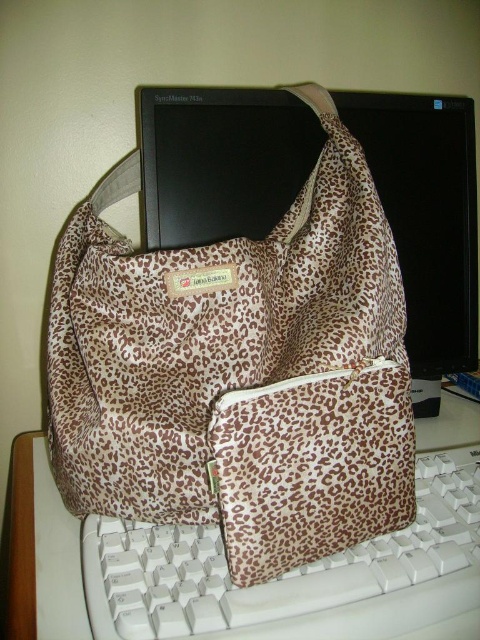
Question: Can you confirm if leopard print fabric bag at center is wider than white plastic keyboard at lower center?

Choices:
 (A) no
 (B) yes

Answer: (A)

Question: Is leopard print fabric bag at center wider than black glossy monitor at upper center?

Choices:
 (A) no
 (B) yes

Answer: (A)

Question: Considering the real-world distances, which object is farthest from the white plastic keyboard at lower center?

Choices:
 (A) black glossy monitor at upper center
 (B) leopard print fabric bag at center

Answer: (A)

Question: Which point is closer to the camera?

Choices:
 (A) (448, 525)
 (B) (214, 330)

Answer: (B)

Question: Estimate the real-world distances between objects in this image. Which object is closer to the leopard print fabric bag at center?

Choices:
 (A) white plastic keyboard at lower center
 (B) black glossy monitor at upper center

Answer: (A)

Question: Is leopard print fabric bag at center smaller than black glossy monitor at upper center?

Choices:
 (A) no
 (B) yes

Answer: (B)